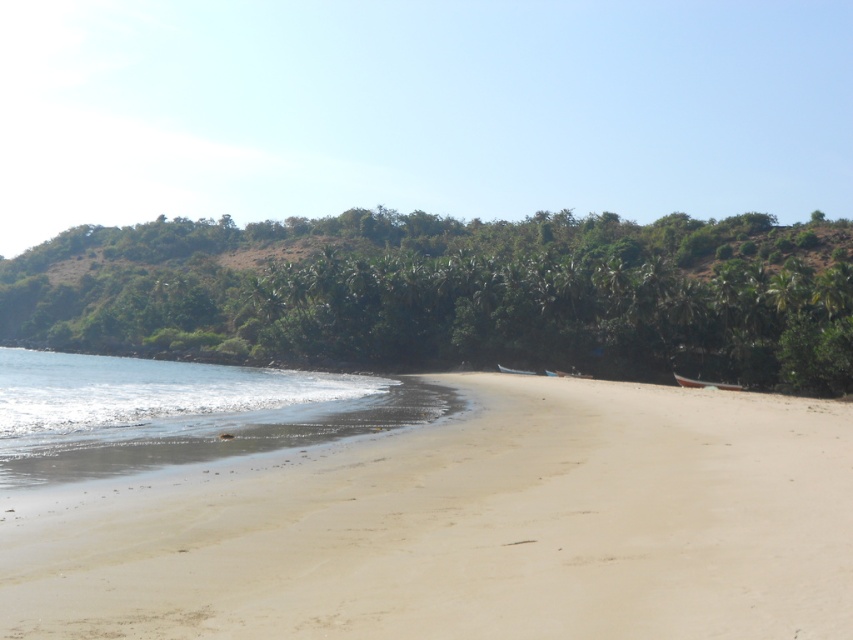
Question: Which object appears closest to the camera in this image?

Choices:
 (A) light beige sand at lower left
 (B) clear water at lower left

Answer: (A)

Question: Is light beige sand at lower left below clear water at lower left?

Choices:
 (A) yes
 (B) no

Answer: (B)

Question: Considering the relative positions of light beige sand at lower left and clear water at lower left in the image provided, where is light beige sand at lower left located with respect to clear water at lower left?

Choices:
 (A) above
 (B) below

Answer: (A)

Question: Which point is farther to the camera?

Choices:
 (A) [x=572, y=552]
 (B) [x=282, y=420]

Answer: (B)

Question: Is light beige sand at lower left wider than clear water at lower left?

Choices:
 (A) no
 (B) yes

Answer: (A)